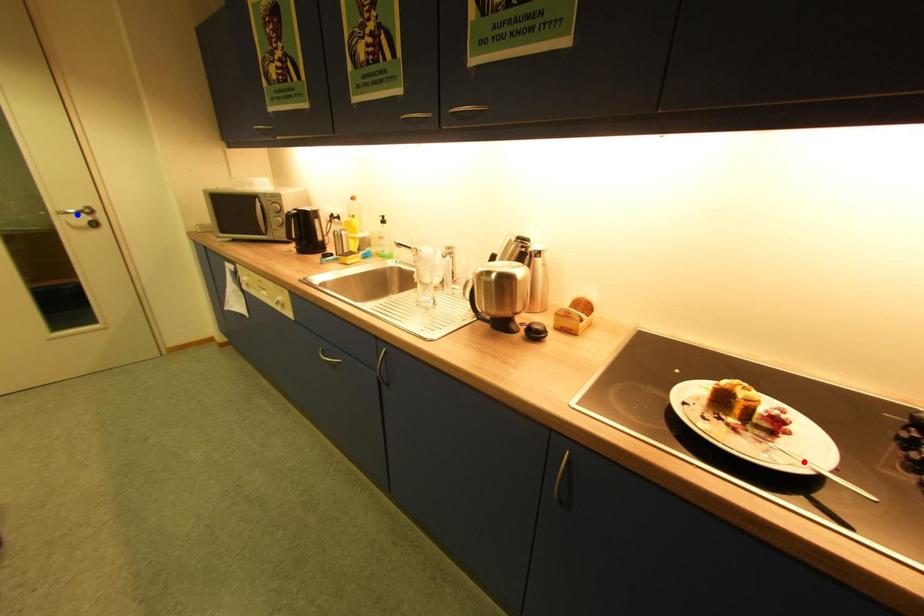
Question: Two points are marked on the image. Which point is closer to the camera?

Choices:
 (A) Blue point is closer.
 (B) Red point is closer.

Answer: (B)